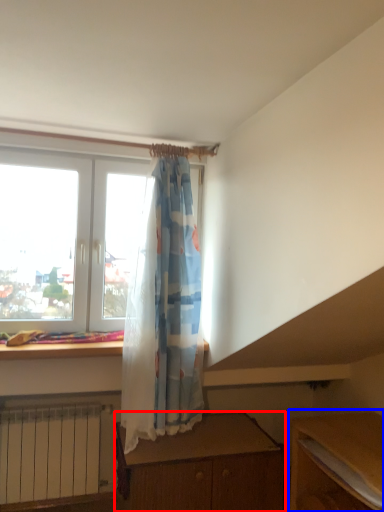
Question: Which point is further to the camera, desk (highlighted by a red box) or table (highlighted by a blue box)?

Choices:
 (A) desk
 (B) table

Answer: (A)